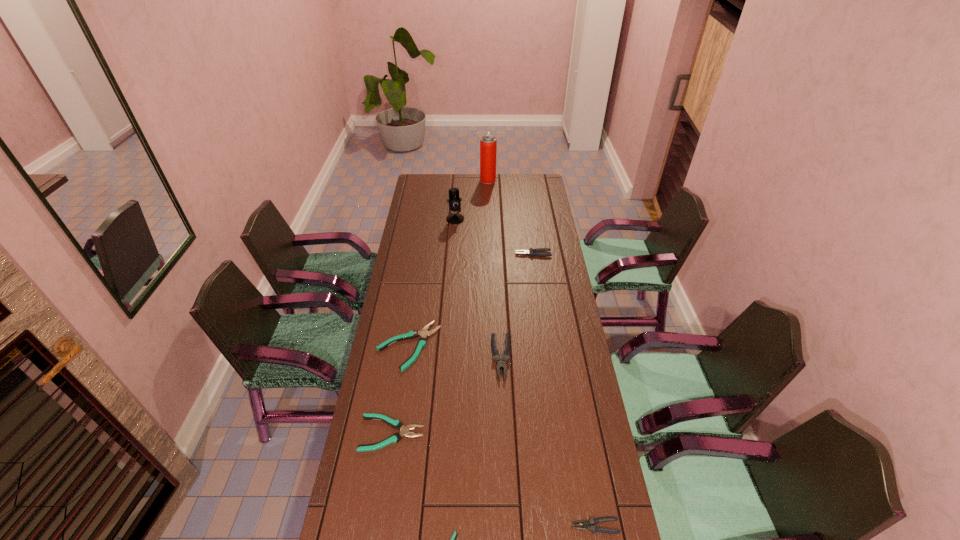
Locate an element on the screen. The image size is (960, 540). teal pliers that is the nearest to the farthest pliers is located at coordinates (422, 342).